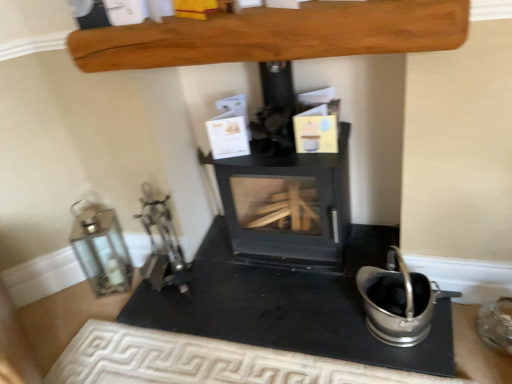
The width and height of the screenshot is (512, 384). I want to click on free space that is in between black matte wood burning stove at center and satin silver bucket at lower right, acting as the 2th appliance starting from the left, so click(x=315, y=289).